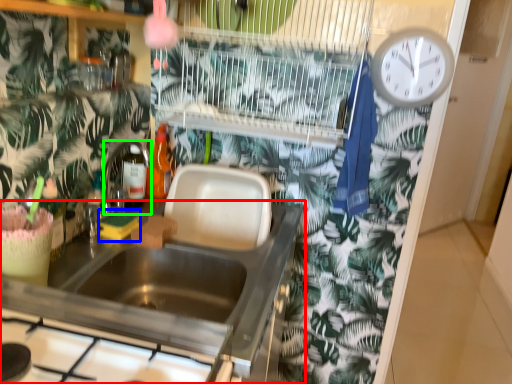
Question: Which is nearer to the countertop (highlighted by a red box)? food (highlighted by a blue box) or faucet (highlighted by a green box).

Choices:
 (A) food
 (B) faucet

Answer: (A)